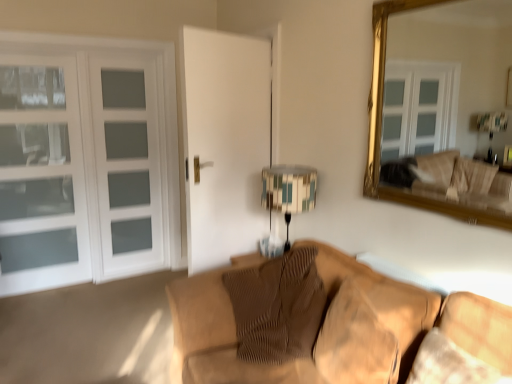
Measure the distance between white glass screen door at left and camera.

white glass screen door at left is 3.51 meters from camera.

What do you see at coordinates (289, 191) in the screenshot? This screenshot has width=512, height=384. I see `patterned fabric lampshade at center` at bounding box center [289, 191].

What is the approximate width of brown textured pillow at center?

20.88 inches.

Locate an element on the screen. The image size is (512, 384). brown textured pillow at center is located at coordinates (277, 307).

This screenshot has width=512, height=384. What do you see at coordinates (466, 343) in the screenshot? I see `textured beige swivel chair at lower right` at bounding box center [466, 343].

Measure the distance between textured beige swivel chair at lower right and camera.

The distance of textured beige swivel chair at lower right from camera is 1.29 meters.

Find the location of a particular element. white glass screen door at left is located at coordinates pos(128,164).

You are a GUI agent. You are given a task and a screenshot of the screen. Output one action in this format:
    pyautogui.click(x=<x>, y=<y>)
    Task: Click on the door that appears on the left of gold-framed mirror at upper right
    The width and height of the screenshot is (512, 384).
    Given the screenshot: What is the action you would take?
    pyautogui.click(x=96, y=157)

Which object is more forward, white glass door at left or gold-framed mirror at upper right?

gold-framed mirror at upper right is in front.

Is white glass door at left thinner than gold-framed mirror at upper right?

In fact, white glass door at left might be wider than gold-framed mirror at upper right.

Is white glass door at left bigger than gold-framed mirror at upper right?

Yes, white glass door at left is bigger than gold-framed mirror at upper right.

From a real-world perspective, is patterned fabric lampshade at center positioned under gold-framed mirror at upper right based on gravity?

Yes.

Does point (310, 180) come closer to viewer compared to point (382, 109)?

Yes, point (310, 180) is in front of point (382, 109).

Is patterned fabric lampshade at center outside of gold-framed mirror at upper right?

Yes, patterned fabric lampshade at center is outside of gold-framed mirror at upper right.

Who is shorter, patterned fabric lampshade at center or gold-framed mirror at upper right?

patterned fabric lampshade at center is shorter.

Is textured beige swivel chair at lower right placed right next to white glass door at left?

There is a gap between textured beige swivel chair at lower right and white glass door at left.

Considering the relative positions of textured beige swivel chair at lower right and white glass door at left in the image provided, is textured beige swivel chair at lower right to the left or to the right of white glass door at left?

textured beige swivel chair at lower right is to the right of white glass door at left.

Is textured beige swivel chair at lower right oriented away from white glass door at left?

No, textured beige swivel chair at lower right is not facing away from white glass door at left.

Considering the positions of point (437, 363) and point (1, 281), is point (437, 363) closer or farther from the camera than point (1, 281)?

Point (437, 363) appears to be closer to the viewer than point (1, 281).

Consider the image. Is white glass cabinet at left bigger or smaller than textured beige swivel chair at lower right?

Considering their sizes, white glass cabinet at left takes up more space than textured beige swivel chair at lower right.

Can you tell me how much white glass cabinet at left and textured beige swivel chair at lower right differ in facing direction?

88.5 degrees separate the facing orientations of white glass cabinet at left and textured beige swivel chair at lower right.

From the picture: Is white glass cabinet at left placed right next to textured beige swivel chair at lower right?

No, white glass cabinet at left is not with textured beige swivel chair at lower right.

Does brown textured pillow at center turn towards textured beige swivel chair at lower right?

Yes, brown textured pillow at center is oriented towards textured beige swivel chair at lower right.

Looking at this image, is brown textured pillow at center wider or thinner than textured beige swivel chair at lower right?

brown textured pillow at center is wider than textured beige swivel chair at lower right.

Which is closer, (298, 254) or (500, 316)?

Point (298, 254) is farther from the camera than point (500, 316).

Would you say white glass door at left is outside textured beige swivel chair at lower right?

That's correct, white glass door at left is outside of textured beige swivel chair at lower right.

From the picture: Which object is closer to the camera taking this photo, white glass door at left or textured beige swivel chair at lower right?

textured beige swivel chair at lower right is in front.

What's the angular difference between white glass door at left and textured beige swivel chair at lower right's facing directions?

The angular difference between white glass door at left and textured beige swivel chair at lower right is 88.6 degrees.

Between white glass door at left and textured beige swivel chair at lower right, which one has smaller width?

Thinner between the two is white glass door at left.

Can you confirm if white glass door at left is thinner than white glass screen door at left?

No, white glass door at left is not thinner than white glass screen door at left.

Considering the relative positions of white glass door at left and white glass screen door at left in the image provided, is white glass door at left to the left of white glass screen door at left from the viewer's perspective?

Yes.

Considering the positions of objects white glass door at left and white glass screen door at left in the image provided, who is in front, white glass door at left or white glass screen door at left?

white glass door at left is in front.

Does white glass door at left contain white glass screen door at left?

Yes.

Locate an element on the screen. mirror above the white glass door at left (from the image's perspective) is located at coordinates 381,128.

Image resolution: width=512 pixels, height=384 pixels. I want to click on table lamp on the left of gold-framed mirror at upper right, so click(x=289, y=191).

When comparing their distances from patterned fabric lampshade at center, does gold-framed mirror at upper right or white glass door at left seem closer?

gold-framed mirror at upper right is positioned closer to the anchor patterned fabric lampshade at center.

Based on the photo, when comparing their distances from white glass door at left, does gold-framed mirror at upper right or brown textured pillow at center seem closer?

brown textured pillow at center is positioned closer to the anchor white glass door at left.

Looking at the image, which one is located further to white glass cabinet at left, textured beige swivel chair at lower right or gold-framed mirror at upper right?

textured beige swivel chair at lower right is positioned further to the anchor white glass cabinet at left.

Based on their spatial positions, is gold-framed mirror at upper right or white glass screen door at left closer to brown textured pillow at center?

Among the two, gold-framed mirror at upper right is located nearer to brown textured pillow at center.

From the image, which object appears to be farther from brown textured pillow at center, patterned fabric lampshade at center or white glass cabinet at left?

white glass cabinet at left lies further to brown textured pillow at center than the other object.

Based on their spatial positions, is patterned fabric lampshade at center or white glass screen door at left further from white glass door at left?

Among the two, patterned fabric lampshade at center is located further to white glass door at left.

Which object lies further to the anchor point white glass cabinet at left, white glass door at left or white glass screen door at left?

The object further to white glass cabinet at left is white glass screen door at left.

From the image, which object appears to be nearer to textured beige swivel chair at lower right, brown textured pillow at center or white glass cabinet at left?

Among the two, brown textured pillow at center is located nearer to textured beige swivel chair at lower right.

This screenshot has width=512, height=384. I want to click on table lamp between white glass cabinet at left and textured beige swivel chair at lower right in the horizontal direction, so click(289, 191).

Image resolution: width=512 pixels, height=384 pixels. I want to click on door situated between white glass cabinet at left and gold-framed mirror at upper right from left to right, so click(x=96, y=157).

Find the location of a particular element. The height and width of the screenshot is (384, 512). pillow located between white glass door at left and patterned fabric lampshade at center in the left-right direction is located at coordinates (277, 307).

Locate an element on the screen. The height and width of the screenshot is (384, 512). pillow located between white glass door at left and textured beige swivel chair at lower right in the left-right direction is located at coordinates [x=277, y=307].